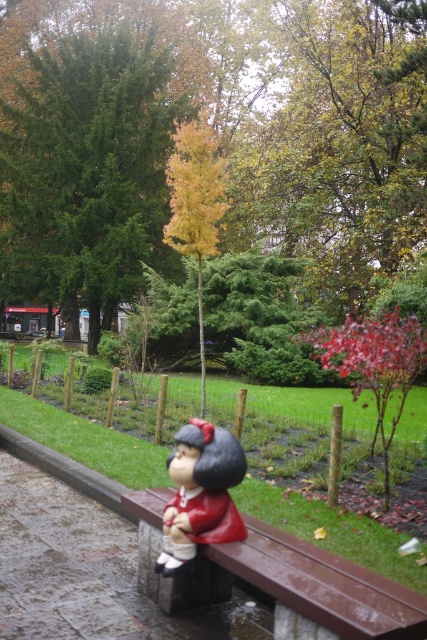
You are a park visitor who wants to take a photo of both the matte red statue at center and the smooth red bark tree at center in the same frame. Given that your camera has a fixed focal length, which object should you move closer to in order to include both in the frame?

Since the matte red statue at center is smaller than the smooth red bark tree at center, you should move closer to the matte red statue at center to ensure both fit in the frame.